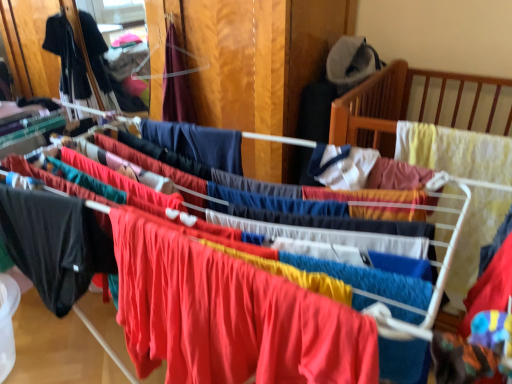
Question: From the image's perspective, is black matte pants at left, the 3th clothing from the right, above black fabric shirt at left, which is counted as the first clothing, starting from the back?

Choices:
 (A) yes
 (B) no

Answer: (B)

Question: Considering the relative sizes of black matte pants at left, which is the 3th clothing in back-to-front order, and black fabric shirt at left, which is counted as the first clothing, starting from the back, in the image provided, is black matte pants at left, which is the 3th clothing in back-to-front order, bigger than black fabric shirt at left, which is counted as the first clothing, starting from the back,?

Choices:
 (A) yes
 (B) no

Answer: (B)

Question: Is black matte pants at left, the 2th clothing viewed from the left, taller than black fabric shirt at left, which is counted as the first clothing, starting from the back?

Choices:
 (A) no
 (B) yes

Answer: (A)

Question: Is black matte pants at left, which is the 3th clothing in back-to-front order, touching black fabric shirt at left, the fourth clothing in the front-to-back sequence?

Choices:
 (A) yes
 (B) no

Answer: (B)

Question: Is black matte pants at left, the 3th clothing from the right, positioned far away from black fabric shirt at left, which is the 4th clothing in right-to-left order?

Choices:
 (A) no
 (B) yes

Answer: (B)

Question: Is matte red fabric at center, the 1th clothing in the right-to-left sequence, bigger or smaller than black fabric shirt at left, the fourth clothing in the front-to-back sequence?

Choices:
 (A) big
 (B) small

Answer: (B)

Question: From a real-world perspective, is matte red fabric at center, the 1th clothing in the right-to-left sequence, physically located above or below black fabric shirt at left, the fourth clothing in the front-to-back sequence?

Choices:
 (A) below
 (B) above

Answer: (A)

Question: Is matte red fabric at center, the 1th clothing viewed from the front, to the left or to the right of black fabric shirt at left, the fourth clothing in the front-to-back sequence, in the image?

Choices:
 (A) right
 (B) left

Answer: (A)

Question: From the image's perspective, is matte red fabric at center, which is counted as the fourth clothing, starting from the left, above or below black fabric shirt at left, the fourth clothing in the front-to-back sequence?

Choices:
 (A) below
 (B) above

Answer: (A)

Question: From the image's perspective, is matte red fabric at center, which is counted as the fourth clothing, starting from the left, above or below velvet burgundy dress at upper center, the 2th clothing in the right-to-left sequence?

Choices:
 (A) above
 (B) below

Answer: (B)

Question: Relative to velvet burgundy dress at upper center, placed as the 3th clothing when sorted from front to back, is matte red fabric at center, positioned as the 4th clothing in back-to-front order, in front or behind?

Choices:
 (A) behind
 (B) front

Answer: (B)

Question: Is point (203, 365) closer or farther from the camera than point (175, 49)?

Choices:
 (A) farther
 (B) closer

Answer: (B)

Question: Would you say matte red fabric at center, positioned as the 4th clothing in back-to-front order, is inside or outside velvet burgundy dress at upper center, the 2th clothing in the right-to-left sequence?

Choices:
 (A) outside
 (B) inside

Answer: (A)

Question: In terms of height, does black matte pants at left, acting as the 2th clothing starting from the front, look taller or shorter compared to matte red fabric at center, the 1th clothing viewed from the front?

Choices:
 (A) tall
 (B) short

Answer: (B)

Question: Does point (57, 243) appear closer or farther from the camera than point (256, 359)?

Choices:
 (A) closer
 (B) farther

Answer: (B)